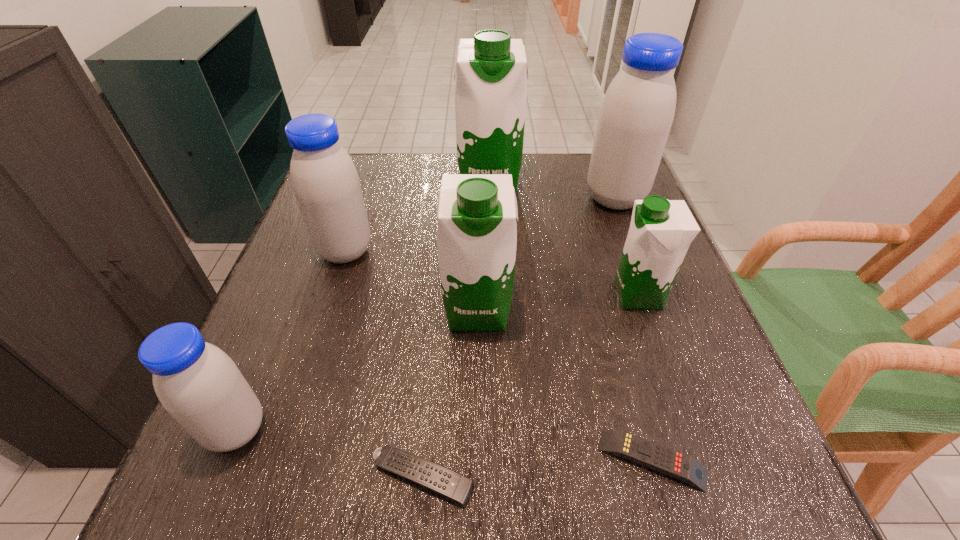
Where is `the biggest green soya milk`? This screenshot has width=960, height=540. the biggest green soya milk is located at coordinates (491, 77).

Identify the location of the farthest blue soya milk. (637, 112).

This screenshot has width=960, height=540. Find the location of `the biggest blue soya milk`. the biggest blue soya milk is located at coordinates (637, 112).

Locate an element on the screen. the third farthest object is located at coordinates (324, 179).

Locate an element on the screen. the second smallest blue soya milk is located at coordinates (324, 179).

Locate an element on the screen. The width and height of the screenshot is (960, 540). the second biggest green soya milk is located at coordinates pyautogui.click(x=477, y=231).

Identify the location of the rightmost green soya milk. Image resolution: width=960 pixels, height=540 pixels. (661, 230).

Find the location of `the smallest blue soya milk`. the smallest blue soya milk is located at coordinates (196, 382).

The width and height of the screenshot is (960, 540). In order to click on the nearest blue soya milk in this screenshot , I will do `click(196, 382)`.

Where is `yellow remote control`? yellow remote control is located at coordinates click(652, 455).